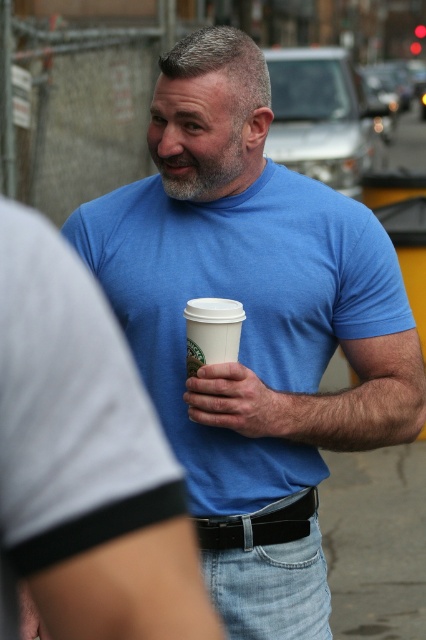
Question: Which point is closer to the camera?

Choices:
 (A) (192, 410)
 (B) (219, 580)
 (C) (192, 131)

Answer: (A)

Question: Which is farther from the jeans at center?

Choices:
 (A) gray matte beard at center
 (B) smooth skin hand at center

Answer: (A)

Question: Is jeans at center positioned at the back of white paper cup at center?

Choices:
 (A) yes
 (B) no

Answer: (A)

Question: Can you confirm if jeans at center is positioned below smooth skin hand at center?

Choices:
 (A) yes
 (B) no

Answer: (A)

Question: Which object appears closest to the camera in this image?

Choices:
 (A) gray matte beard at center
 (B) white paper cup at center
 (C) smooth skin hand at center

Answer: (B)

Question: Is jeans at center to the left of white paper cup at center from the viewer's perspective?

Choices:
 (A) no
 (B) yes

Answer: (A)